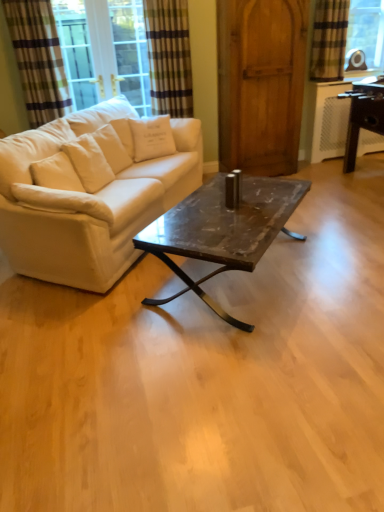
Identify the location of vacant point above marble/black metal coffee table at center (from a real-world perspective). This screenshot has height=512, width=384. (228, 210).